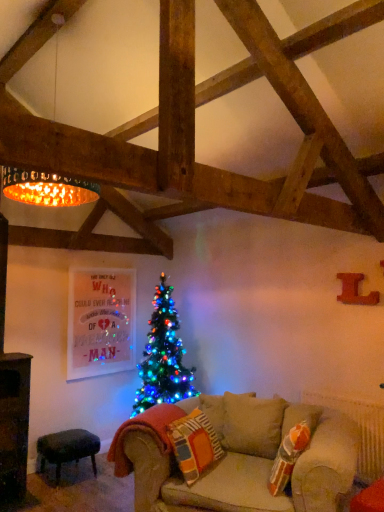
Question: From their relative heights in the image, would you say knitted fabric pillow at lower center is taller or shorter than golden metallic lampshade at upper left?

Choices:
 (A) tall
 (B) short

Answer: (B)

Question: Is knitted fabric pillow at lower center spatially inside golden metallic lampshade at upper left, or outside of it?

Choices:
 (A) outside
 (B) inside

Answer: (A)

Question: Which object is positioned closest to the knitted fabric pillow at lower center?

Choices:
 (A) velvet dark green stool at lower left
 (B) golden metallic lampshade at upper left

Answer: (A)

Question: Estimate the real-world distances between objects in this image. Which object is farther from the velvet dark green stool at lower left?

Choices:
 (A) knitted fabric pillow at lower center
 (B) golden metallic lampshade at upper left

Answer: (B)